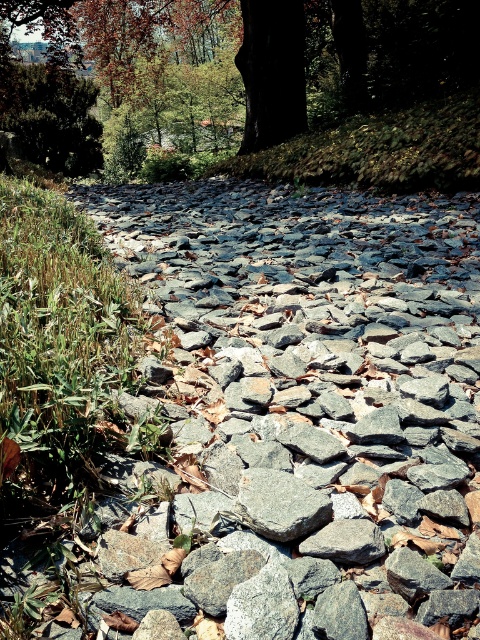
You are a photographer standing at the edge of the stone bed pathway. You want to take a photo that includes both the point at coordinates (420, 396) and the point at (288, 58). Which point will appear closer to the camera in the photo?

Point (420, 396) will appear closer to the camera in the photo because it is physically closer to the camera than point (288, 58).

You are a hiker who wants to place a small backpack on the ground. You see the dark brown bark at upper center and the gray rough stone at center. Which surface is higher and more stable for placing your backpack?

The dark brown bark at upper center is positioned over the gray rough stone at center, so it is higher and more stable for placing the backpack.